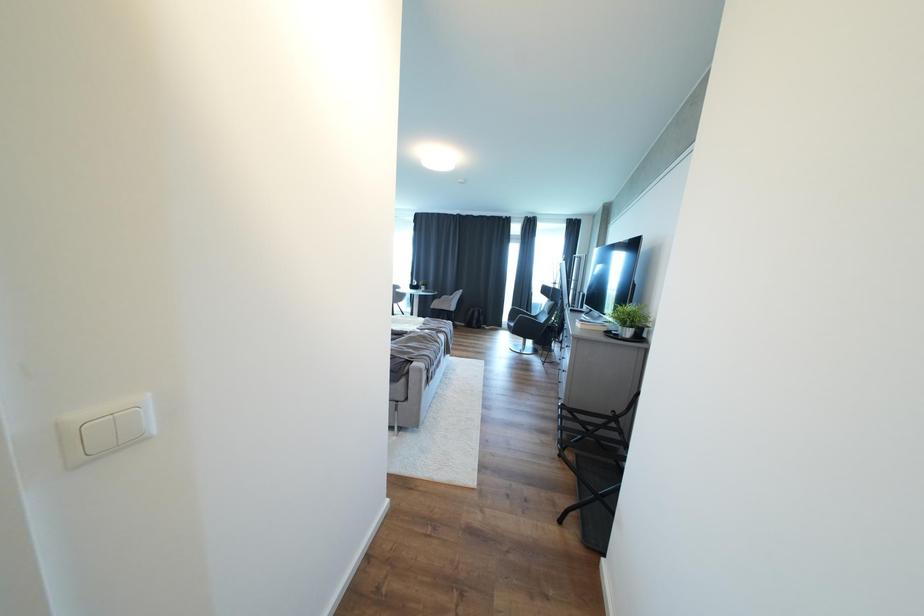
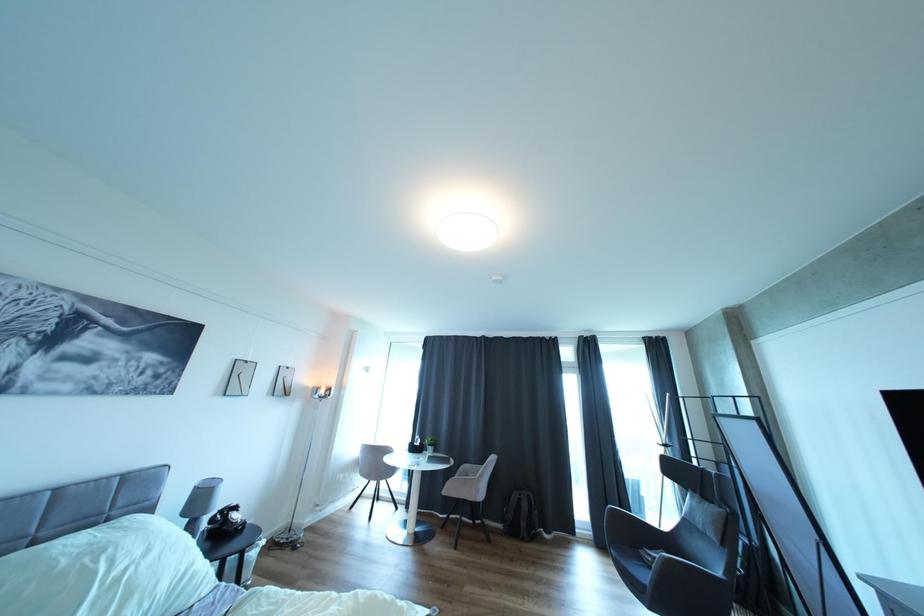
Question: The images are taken continuously from a first-person perspective. In which direction are you moving?

Choices:
 (A) Left
 (B) Right
 (C) Forward
 (D) Backward

Answer: (C)